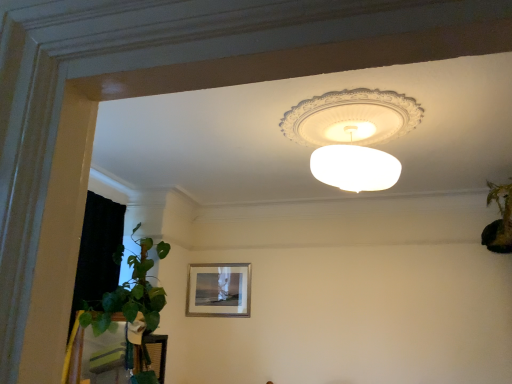
Image resolution: width=512 pixels, height=384 pixels. I want to click on green leafy plant at right, so click(499, 219).

What do you see at coordinates (353, 135) in the screenshot? I see `white frosted glass lampshade at upper center` at bounding box center [353, 135].

What is the approximate width of matte silver picture frame at center?

The width of matte silver picture frame at center is 1.19 inches.

Locate an element on the screen. This screenshot has height=384, width=512. green leafy plant at right is located at coordinates (499, 219).

Does white frosted glass lampshade at upper center have a greater height compared to matte silver picture frame at center?

In fact, white frosted glass lampshade at upper center may be shorter than matte silver picture frame at center.

Can you confirm if white frosted glass lampshade at upper center is wider than matte silver picture frame at center?

Yes.

Can we say white frosted glass lampshade at upper center lies outside matte silver picture frame at center?

Yes, white frosted glass lampshade at upper center is located beyond the bounds of matte silver picture frame at center.

Is matte silver picture frame at center shorter than white frosted glass lampshade at upper center?

Incorrect, the height of matte silver picture frame at center does not fall short of that of white frosted glass lampshade at upper center.

Can you tell me how much matte silver picture frame at center and white frosted glass lampshade at upper center differ in facing direction?

The angular difference between matte silver picture frame at center and white frosted glass lampshade at upper center is 169 degrees.

Which object is further away from the camera, matte silver picture frame at center or white frosted glass lampshade at upper center?

matte silver picture frame at center is more distant.

Considering the positions of objects matte silver picture frame at center and white frosted glass lampshade at upper center in the image provided, who is more to the left, matte silver picture frame at center or white frosted glass lampshade at upper center?

Positioned to the left is matte silver picture frame at center.

Can you tell me how much white frosted glass lampshade at upper center and green leafy plant at right differ in facing direction?

173 degrees separate the facing orientations of white frosted glass lampshade at upper center and green leafy plant at right.

Between white frosted glass lampshade at upper center and green leafy plant at right, which one has larger size?

With larger size is white frosted glass lampshade at upper center.

Is white frosted glass lampshade at upper center oriented away from green leafy plant at right?

No, white frosted glass lampshade at upper center's orientation is not away from green leafy plant at right.

I want to click on lamp in front of the green leafy plant at right, so click(353, 135).

Based on their sizes in the image, would you say green leafy plant at right is bigger or smaller than matte silver picture frame at center?

Clearly, green leafy plant at right is larger in size than matte silver picture frame at center.

From the picture: Is green leafy plant at right positioned with its back to matte silver picture frame at center?

That's not correct — green leafy plant at right is not looking away from matte silver picture frame at center.

From the image's perspective, does green leafy plant at right appear lower than matte silver picture frame at center?

Actually, green leafy plant at right appears above matte silver picture frame at center in the image.

Which object is closer to the camera taking this photo, green leafy plant at right or matte silver picture frame at center?

green leafy plant at right.

Where is `picture frame on the left of green leafy plant at right`? Image resolution: width=512 pixels, height=384 pixels. picture frame on the left of green leafy plant at right is located at coordinates (219, 290).

Would you consider matte silver picture frame at center to be distant from green leafy plant at right?

Yes, matte silver picture frame at center is far from green leafy plant at right.

Which of these two, matte silver picture frame at center or green leafy plant at right, stands shorter?

Standing shorter between the two is green leafy plant at right.

Can white frosted glass lampshade at upper center be found inside green leafy plant at right?

No, white frosted glass lampshade at upper center is not surrounded by green leafy plant at right.

From the image's perspective, who appears lower, green leafy plant at right or white frosted glass lampshade at upper center?

green leafy plant at right.

Which of these two, green leafy plant at right or white frosted glass lampshade at upper center, is thinner?

green leafy plant at right is thinner.

Is green leafy plant at right at the right side of white frosted glass lampshade at upper center?

Correct, you'll find green leafy plant at right to the right of white frosted glass lampshade at upper center.

Find the location of `picture frame located underneath the white frosted glass lampshade at upper center (from a real-world perspective)`. picture frame located underneath the white frosted glass lampshade at upper center (from a real-world perspective) is located at coordinates 219,290.

In order to click on lamp on the right of the matte silver picture frame at center in this screenshot , I will do `click(353, 135)`.

In the scene shown: Estimate the real-world distances between objects in this image. Which object is further from matte silver picture frame at center, white frosted glass lampshade at upper center or green leafy plant at right?

Based on the image, green leafy plant at right appears to be further to matte silver picture frame at center.

Which object lies nearer to the anchor point green leafy plant at right, matte silver picture frame at center or white frosted glass lampshade at upper center?

white frosted glass lampshade at upper center.

Which object lies further to the anchor point white frosted glass lampshade at upper center, green leafy plant at right or matte silver picture frame at center?

matte silver picture frame at center is further to white frosted glass lampshade at upper center.

Considering their positions, is white frosted glass lampshade at upper center positioned closer to green leafy plant at right than matte silver picture frame at center?

white frosted glass lampshade at upper center is positioned closer to the anchor green leafy plant at right.

Looking at the image, which one is located further to matte silver picture frame at center, green leafy plant at right or white frosted glass lampshade at upper center?

green leafy plant at right.

From the image, which object appears to be nearer to white frosted glass lampshade at upper center, matte silver picture frame at center or green leafy plant at right?

The object closer to white frosted glass lampshade at upper center is green leafy plant at right.

Locate an element on the screen. houseplant between white frosted glass lampshade at upper center and matte silver picture frame at center in the front-back direction is located at coordinates (499, 219).